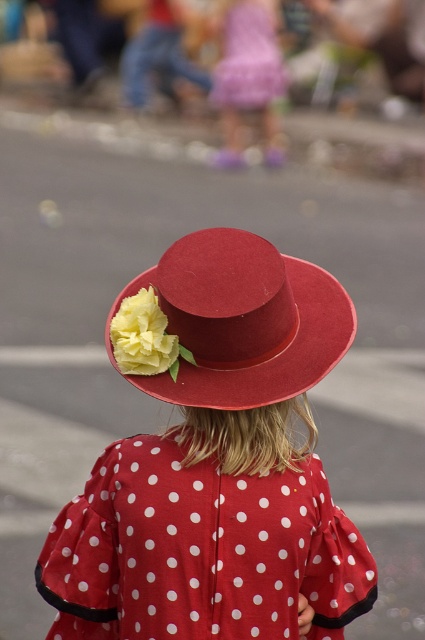
Question: Does matte felt hat at center have a smaller size compared to matte yellow fabric dress at upper center?

Choices:
 (A) yes
 (B) no

Answer: (A)

Question: Is matte felt hat at center positioned at the back of matte red hat at center?

Choices:
 (A) yes
 (B) no

Answer: (A)

Question: Does matte felt hat at center appear on the left side of yellow fabric flower at center?

Choices:
 (A) no
 (B) yes

Answer: (A)

Question: Which point is closer to the camera?

Choices:
 (A) matte red hat at center
 (B) yellow fabric flower at center

Answer: (A)

Question: Which point appears closest to the camera in this image?

Choices:
 (A) (183, 358)
 (B) (136, 314)

Answer: (B)

Question: Which of these objects is positioned closest to the yellow fabric flower at center?

Choices:
 (A) matte felt hat at center
 (B) matte red hat at center
 (C) matte yellow fabric dress at upper center

Answer: (B)